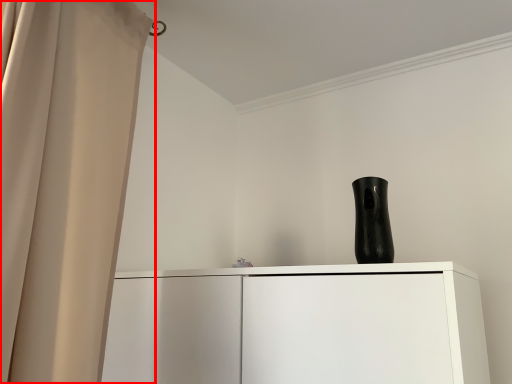
Question: From the image's perspective, what is the correct spatial positioning of curtain (annotated by the red box) in reference to vase?

Choices:
 (A) above
 (B) below

Answer: (A)